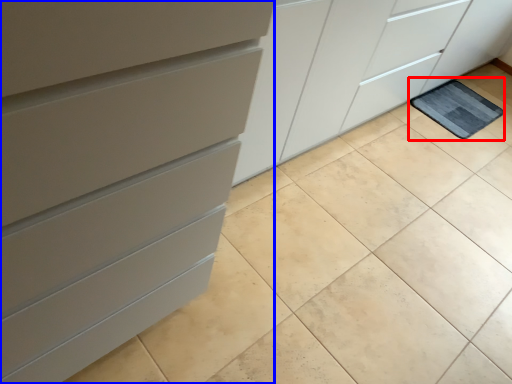
Question: Which of the following is the farthest to the observer, bath mat (highlighted by a red box) or chest of drawers (highlighted by a blue box)?

Choices:
 (A) bath mat
 (B) chest of drawers

Answer: (A)